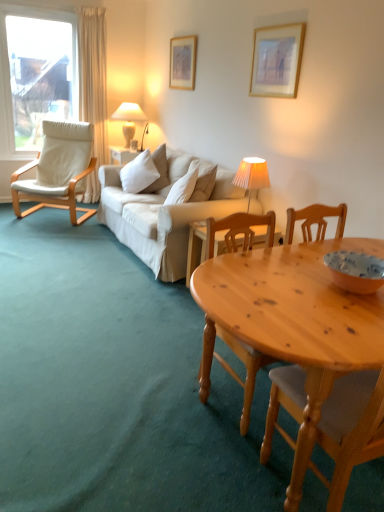
Locate an element on the screen. This screenshot has width=384, height=512. vacant space situated above matte orange bowl at lower right (from a real-world perspective) is located at coordinates (359, 260).